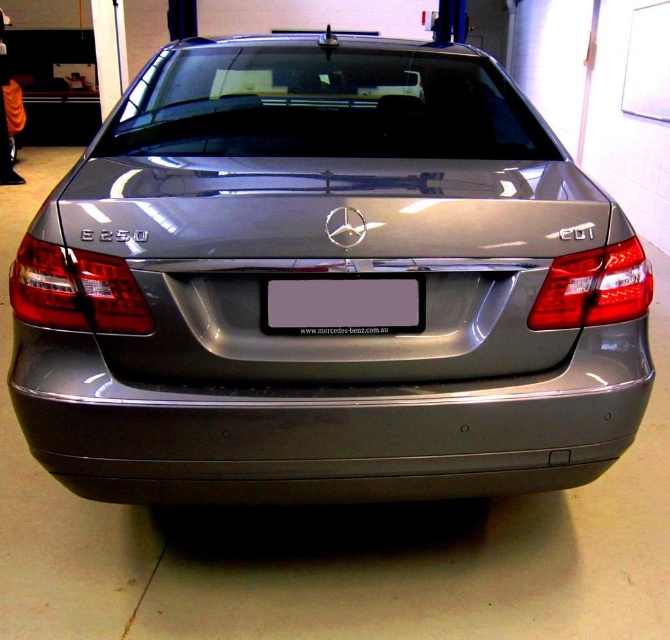
Question: Which object is positioned closest to the satin metallic bumper at center?

Choices:
 (A) gray matte license plate at center
 (B) satin metallic car at center

Answer: (B)

Question: Is satin metallic car at center bigger than satin metallic bumper at center?

Choices:
 (A) no
 (B) yes

Answer: (B)

Question: Can you confirm if satin metallic car at center is smaller than gray matte license plate at center?

Choices:
 (A) no
 (B) yes

Answer: (A)

Question: Where is satin metallic car at center located in relation to gray matte license plate at center in the image?

Choices:
 (A) below
 (B) above

Answer: (B)

Question: Which point appears farthest from the camera in this image?

Choices:
 (A) (421, 321)
 (B) (29, 436)
 (C) (48, 420)

Answer: (B)

Question: Which of the following is the farthest from the observer?

Choices:
 (A) (397, 280)
 (B) (500, 468)
 (C) (247, 177)

Answer: (C)